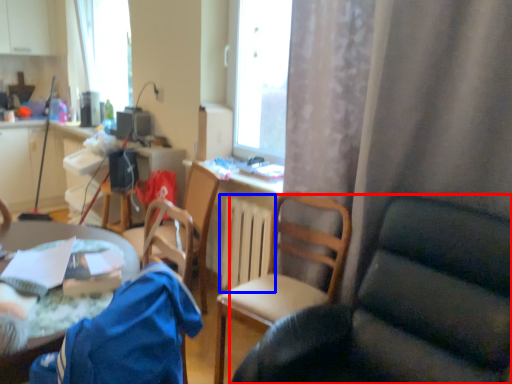
Question: Which object appears farthest to the camera in this image, chair (highlighted by a red box) or radiator (highlighted by a blue box)?

Choices:
 (A) chair
 (B) radiator

Answer: (B)